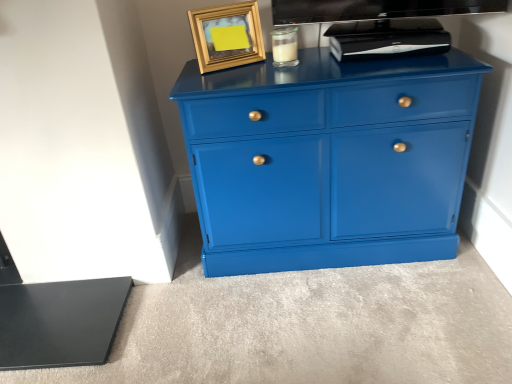
Where is `gold metallic picture frame at upper center`? gold metallic picture frame at upper center is located at coordinates (227, 36).

Measure the distance between point (291, 52) and camera.

Point (291, 52) and camera are 4.69 feet apart from each other.

The image size is (512, 384). Find the location of `clear glass jar at upper center`. clear glass jar at upper center is located at coordinates (285, 46).

The width and height of the screenshot is (512, 384). Identify the location of glossy blue cabinet at center. (328, 160).

At what (x,y) coordinates should I click in order to perform the action: click on gold metallic picture frame at upper center. Please return your answer as a coordinate pair (x, y). This screenshot has height=384, width=512. Looking at the image, I should click on (227, 36).

Which object is closer to the camera, gold metallic picture frame at upper center or clear glass jar at upper center?

Positioned in front is gold metallic picture frame at upper center.

Is gold metallic picture frame at upper center smaller than clear glass jar at upper center?

No, gold metallic picture frame at upper center is not smaller than clear glass jar at upper center.

From a real-world perspective, relative to clear glass jar at upper center, is gold metallic picture frame at upper center vertically above or below?

In terms of real-world spatial position, gold metallic picture frame at upper center is above clear glass jar at upper center.

Can you tell me how much gold metallic picture frame at upper center and clear glass jar at upper center differ in facing direction?

The angle between the facing direction of gold metallic picture frame at upper center and the facing direction of clear glass jar at upper center is 29.9 degrees.

There is a glossy blue cabinet at center. At what (x,y) coordinates should I click in order to perform the action: click on picture frame above it (from a real-world perspective). Please return your answer as a coordinate pair (x, y). The width and height of the screenshot is (512, 384). Looking at the image, I should click on (227, 36).

Based on their sizes in the image, would you say gold metallic picture frame at upper center is bigger or smaller than glossy blue cabinet at center?

Clearly, gold metallic picture frame at upper center is smaller in size than glossy blue cabinet at center.

Considering the relative sizes of gold metallic picture frame at upper center and glossy blue cabinet at center in the image provided, is gold metallic picture frame at upper center shorter than glossy blue cabinet at center?

Yes.

What's the angular difference between gold metallic picture frame at upper center and glossy blue cabinet at center's facing directions?

There is a 27.8-degree angle between the facing directions of gold metallic picture frame at upper center and glossy blue cabinet at center.

How much distance is there between glossy blue cabinet at center and gold metallic picture frame at upper center?

glossy blue cabinet at center is 15.33 inches from gold metallic picture frame at upper center.

Is glossy blue cabinet at center bigger than gold metallic picture frame at upper center?

Yes, glossy blue cabinet at center is bigger than gold metallic picture frame at upper center.

Is gold metallic picture frame at upper center at the back of glossy blue cabinet at center?

No, gold metallic picture frame at upper center is not at the back of glossy blue cabinet at center.

Is point (458, 201) less distant than point (208, 39)?

No, it is behind (208, 39).

Considering the points (289, 47) and (210, 145), which point is in front, point (289, 47) or point (210, 145)?

The point (210, 145) is closer to the camera.

Considering the sizes of clear glass jar at upper center and glossy blue cabinet at center in the image, is clear glass jar at upper center bigger or smaller than glossy blue cabinet at center?

clear glass jar at upper center is smaller than glossy blue cabinet at center.

From the picture: Is clear glass jar at upper center facing away from glossy blue cabinet at center?

No.

Is clear glass jar at upper center taller than glossy blue cabinet at center?

Incorrect, the height of clear glass jar at upper center is not larger of that of glossy blue cabinet at center.

Considering the sizes of objects clear glass jar at upper center and black plastic device at upper center in the image provided, who is thinner, clear glass jar at upper center or black plastic device at upper center?

With smaller width is clear glass jar at upper center.

Is clear glass jar at upper center positioned behind black plastic device at upper center?

Yes, clear glass jar at upper center is behind black plastic device at upper center.

Can you tell me how much clear glass jar at upper center and black plastic device at upper center differ in facing direction?

They differ by 1.05 degrees in their facing directions.

From the image's perspective, is clear glass jar at upper center located beneath black plastic device at upper center?

Yes, from the image's perspective, clear glass jar at upper center is below black plastic device at upper center.

How many degrees apart are the facing directions of black plastic device at upper center and glossy blue cabinet at center?

0.99 degrees.

Based on the photo, between black plastic device at upper center and glossy blue cabinet at center, which one has smaller width?

black plastic device at upper center.

Is point (368, 51) more distant than point (232, 255)?

No.

Find the location of a particular element. Image resolution: width=512 pixels, height=384 pixels. appliance above the glossy blue cabinet at center (from the image's perspective) is located at coordinates click(387, 38).

Is there a large distance between black plastic device at upper center and clear glass jar at upper center?

No, black plastic device at upper center is not far away from clear glass jar at upper center.

Considering the relative sizes of black plastic device at upper center and clear glass jar at upper center in the image provided, is black plastic device at upper center smaller than clear glass jar at upper center?

Incorrect, black plastic device at upper center is not smaller in size than clear glass jar at upper center.

Between black plastic device at upper center and clear glass jar at upper center, which one has smaller width?

clear glass jar at upper center is thinner.

Image resolution: width=512 pixels, height=384 pixels. What are the coordinates of `appliance above the clear glass jar at upper center (from the image's perspective)` in the screenshot? It's located at (387, 38).

Locate an element on the screen. The height and width of the screenshot is (384, 512). candle holder that appears below the gold metallic picture frame at upper center (from a real-world perspective) is located at coordinates (285, 46).

Locate an element on the screen. Image resolution: width=512 pixels, height=384 pixels. the chest of drawers below the gold metallic picture frame at upper center (from the image's perspective) is located at coordinates (328, 160).

Considering their positions, is gold metallic picture frame at upper center positioned closer to clear glass jar at upper center than black plastic device at upper center?

gold metallic picture frame at upper center.

Which object lies further to the anchor point glossy blue cabinet at center, black plastic device at upper center or clear glass jar at upper center?

clear glass jar at upper center is further to glossy blue cabinet at center.

In the scene shown: Which object lies further to the anchor point gold metallic picture frame at upper center, black plastic device at upper center or glossy blue cabinet at center?

The object further to gold metallic picture frame at upper center is black plastic device at upper center.

Looking at the image, which one is located further to clear glass jar at upper center, glossy blue cabinet at center or gold metallic picture frame at upper center?

Among the two, glossy blue cabinet at center is located further to clear glass jar at upper center.

From the image, which object appears to be nearer to gold metallic picture frame at upper center, clear glass jar at upper center or glossy blue cabinet at center?

clear glass jar at upper center lies closer to gold metallic picture frame at upper center than the other object.

Looking at the image, which one is located further to gold metallic picture frame at upper center, clear glass jar at upper center or black plastic device at upper center?

black plastic device at upper center lies further to gold metallic picture frame at upper center than the other object.

Looking at the image, which one is located further to clear glass jar at upper center, gold metallic picture frame at upper center or glossy blue cabinet at center?

The object further to clear glass jar at upper center is glossy blue cabinet at center.

Based on their spatial positions, is gold metallic picture frame at upper center or clear glass jar at upper center closer to black plastic device at upper center?

clear glass jar at upper center.

Identify the location of candle holder between gold metallic picture frame at upper center and glossy blue cabinet at center vertically. The height and width of the screenshot is (384, 512). (285, 46).

Identify the location of candle holder located between gold metallic picture frame at upper center and black plastic device at upper center in the left-right direction. (285, 46).

Identify the location of candle holder that lies between black plastic device at upper center and glossy blue cabinet at center from top to bottom. (285, 46).

Where is `the chest of drawers located between gold metallic picture frame at upper center and black plastic device at upper center in the left-right direction`? The height and width of the screenshot is (384, 512). the chest of drawers located between gold metallic picture frame at upper center and black plastic device at upper center in the left-right direction is located at coordinates (328, 160).